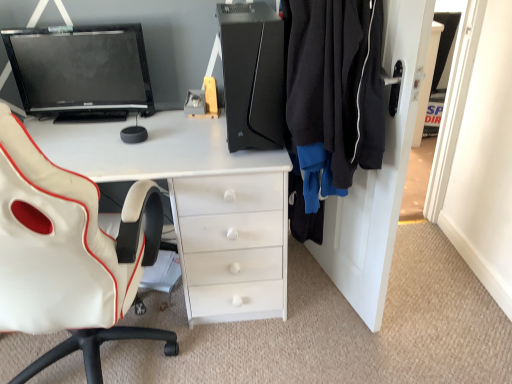
What is the approximate width of black matte dresser at right?

6.22 inches.

Describe the element at coordinates (333, 92) in the screenshot. This screenshot has width=512, height=384. I see `black fleece jacket at right` at that location.

What is the approximate width of white glossy desk at center?

white glossy desk at center is 24.81 inches wide.

What is the approximate width of white leather chair at left?

28.37 inches.

Image resolution: width=512 pixels, height=384 pixels. What do you see at coordinates (81, 71) in the screenshot?
I see `matte black monitor at upper left` at bounding box center [81, 71].

What do you see at coordinates (253, 75) in the screenshot? Image resolution: width=512 pixels, height=384 pixels. I see `black matte computer tower at center` at bounding box center [253, 75].

At what (x,y) coordinates should I click in order to perform the action: click on black matte dresser at right. Please return your answer as a coordinate pair (x, y). The width and height of the screenshot is (512, 384). Looking at the image, I should click on (379, 174).

What's the angular difference between matte black monitor at upper left and black fleece jacket at right's facing directions?

They differ by 73.9 degrees in their facing directions.

The width and height of the screenshot is (512, 384). Identify the location of computer monitor above the black fleece jacket at right (from a real-world perspective). (81, 71).

Is matte black monitor at upper left far from black fleece jacket at right?

No, matte black monitor at upper left is in close proximity to black fleece jacket at right.

In terms of size, does matte black monitor at upper left appear bigger or smaller than black fleece jacket at right?

matte black monitor at upper left is smaller than black fleece jacket at right.

How distant is black matte computer tower at center from white leather chair at left?

black matte computer tower at center and white leather chair at left are 22.44 inches apart from each other.

In terms of size, does black matte computer tower at center appear bigger or smaller than white leather chair at left?

In the image, black matte computer tower at center appears to be smaller than white leather chair at left.

Are black matte computer tower at center and white leather chair at left located far from each other?

black matte computer tower at center is near white leather chair at left, not far away.

From a real-world perspective, does black fleece jacket at right stand above white glossy desk at center?

Yes, from a real-world perspective, black fleece jacket at right is on top of white glossy desk at center.

Measure the distance between black fleece jacket at right and white glossy desk at center.

black fleece jacket at right is 16.07 inches away from white glossy desk at center.

Between point (308, 153) and point (179, 190), which one is positioned in front?

Positioned in front is point (308, 153).

Is black fleece jacket at right taller than white glossy desk at center?

No.

From a real-world perspective, is matte black monitor at upper left physically located above or below white glossy desk at center?

Clearly, from a real-world perspective, matte black monitor at upper left is above white glossy desk at center.

Between matte black monitor at upper left and white glossy desk at center, which one is positioned behind?

matte black monitor at upper left.

Is matte black monitor at upper left facing away from white glossy desk at center?

No, matte black monitor at upper left's orientation is not away from white glossy desk at center.

In the image, is matte black monitor at upper left on the left side or the right side of white glossy desk at center?

matte black monitor at upper left is positioned on white glossy desk at center's left side.

In the scene shown: Is white glossy desk at center looking in the opposite direction of black matte computer tower at center?

white glossy desk at center is not turned away from black matte computer tower at center.

From the image's perspective, relative to black matte computer tower at center, is white glossy desk at center above or below?

From the image's perspective, white glossy desk at center appears below black matte computer tower at center.

Considering the relative positions of white glossy desk at center and black matte computer tower at center in the image provided, is white glossy desk at center to the right of black matte computer tower at center from the viewer's perspective?

In fact, white glossy desk at center is to the left of black matte computer tower at center.

Consider the image. Does white glossy desk at center lie in front of black matte computer tower at center?

No, white glossy desk at center is further to the viewer.

In terms of width, does black matte dresser at right look wider or thinner when compared to white glossy desk at center?

Considering their sizes, black matte dresser at right looks slimmer than white glossy desk at center.

At what (x,y) coordinates should I click in order to perform the action: click on dresser on the right of white glossy desk at center. Please return your answer as a coordinate pair (x, y). The image size is (512, 384). Looking at the image, I should click on (379, 174).

Which object is further away from the camera taking this photo, black matte dresser at right or white glossy desk at center?

white glossy desk at center is further from the camera.

From the image's perspective, is black fleece jacket at right on matte black monitor at upper left?

No, from the image's perspective, black fleece jacket at right is not on top of matte black monitor at upper left.

Considering the sizes of black fleece jacket at right and matte black monitor at upper left in the image, is black fleece jacket at right taller or shorter than matte black monitor at upper left?

In the image, black fleece jacket at right appears to be taller than matte black monitor at upper left.

From a real-world perspective, who is located lower, black fleece jacket at right or matte black monitor at upper left?

black fleece jacket at right is physically lower.

Where is `computer monitor above the black fleece jacket at right (from the image's perspective)`? computer monitor above the black fleece jacket at right (from the image's perspective) is located at coordinates (81, 71).

Identify the location of computer tower above the white leather chair at left (from a real-world perspective). The width and height of the screenshot is (512, 384). (253, 75).

Based on their spatial positions, is matte black monitor at upper left or black fleece jacket at right further from white leather chair at left?

Based on the image, matte black monitor at upper left appears to be further to white leather chair at left.

Estimate the real-world distances between objects in this image. Which object is closer to black fleece jacket at right, black matte dresser at right or white glossy desk at center?

black matte dresser at right is positioned closer to the anchor black fleece jacket at right.

From the image, which object appears to be nearer to white glossy desk at center, black fleece jacket at right or white leather chair at left?

white leather chair at left is closer to white glossy desk at center.

Which object lies further to the anchor point matte black monitor at upper left, white glossy desk at center or black fleece jacket at right?

black fleece jacket at right.

Based on their spatial positions, is white leather chair at left or white glossy desk at center closer to black matte computer tower at center?

Based on the image, white glossy desk at center appears to be nearer to black matte computer tower at center.

Estimate the real-world distances between objects in this image. Which object is closer to white glossy desk at center, black matte dresser at right or black matte computer tower at center?

Based on the image, black matte computer tower at center appears to be nearer to white glossy desk at center.

Which object lies nearer to the anchor point black matte dresser at right, white glossy desk at center or matte black monitor at upper left?

white glossy desk at center is positioned closer to the anchor black matte dresser at right.

Based on their spatial positions, is black matte dresser at right or black matte computer tower at center further from white leather chair at left?

Result: black matte dresser at right.

Find the location of a particular element. This screenshot has height=384, width=512. computer tower between white leather chair at left and black fleece jacket at right is located at coordinates (253, 75).

You are a GUI agent. You are given a task and a screenshot of the screen. Output one action in this format:
    pyautogui.click(x=<x>, y=<y>)
    Task: Click on the computer tower situated between white leather chair at left and black matte dresser at right from left to right
    The image size is (512, 384).
    Given the screenshot: What is the action you would take?
    pyautogui.click(x=253, y=75)

In order to click on desk located between white leather chair at left and matte black monitor at upper left in the depth direction in this screenshot , I will do `click(198, 204)`.

I want to click on computer tower positioned between white leather chair at left and matte black monitor at upper left from near to far, so click(x=253, y=75).